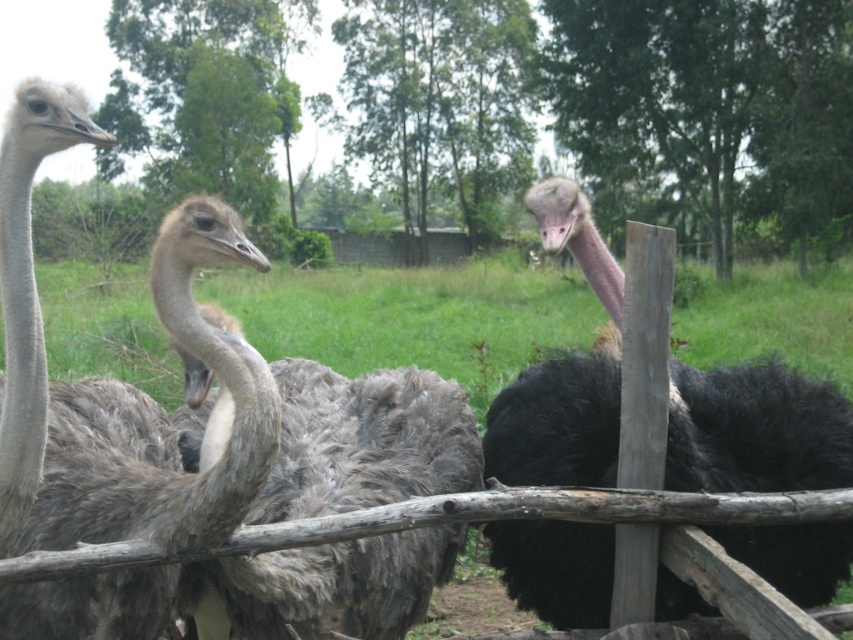
Question: Can you confirm if gray feathered ostrich at left is positioned above gray feathered ostrich at center?

Choices:
 (A) no
 (B) yes

Answer: (A)

Question: Which point is closer to the camera?

Choices:
 (A) gray feathered ostrich at left
 (B) black feathered ostrich at center

Answer: (A)

Question: In this image, where is gray feathered ostrich at left located relative to black feathered ostrich at center?

Choices:
 (A) above
 (B) below

Answer: (A)

Question: Can you confirm if gray feathered ostrich at left is smaller than gray feathered ostrich at center?

Choices:
 (A) yes
 (B) no

Answer: (B)

Question: Based on their relative distances, which object is farther from the gray feathered ostrich at center?

Choices:
 (A) gray feathered ostrich at left
 (B) black feathered ostrich at center

Answer: (B)

Question: Among these objects, which one is farthest from the camera?

Choices:
 (A) black feathered ostrich at center
 (B) gray feathered ostrich at center
 (C) gray feathered ostrich at left

Answer: (A)